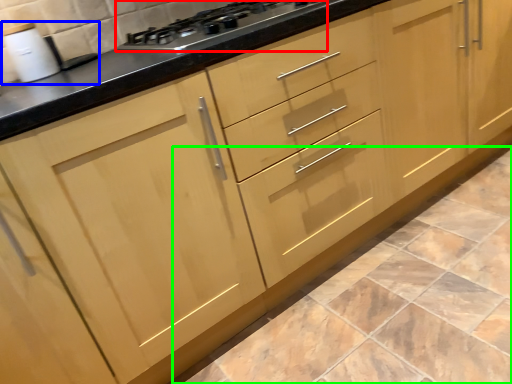
Question: Which object is positioned farthest from gas stove (highlighted by a red box)? Select from sink (highlighted by a blue box) and ceramic tile (highlighted by a green box).

Choices:
 (A) sink
 (B) ceramic tile

Answer: (B)